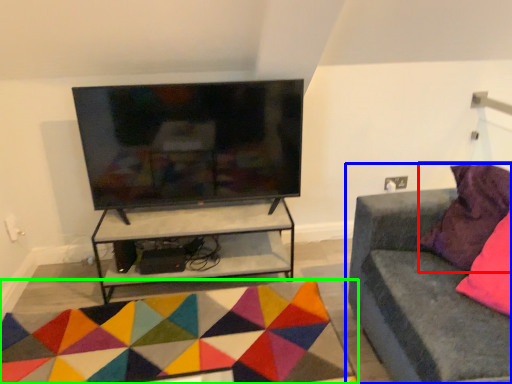
Question: Based on their relative distances, which object is farther from pillow (highlighted by a red box)? Choose from studio couch (highlighted by a blue box) and mat (highlighted by a green box).

Choices:
 (A) studio couch
 (B) mat

Answer: (B)